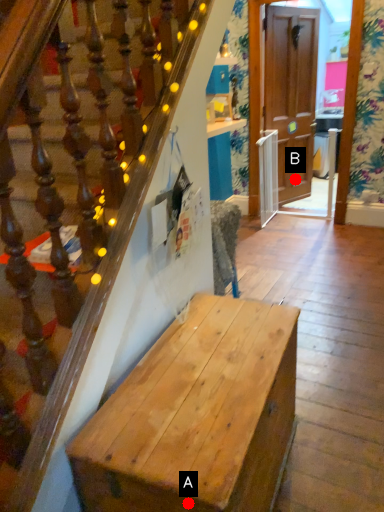
Question: Two points are circled on the image, labeled by A and B beside each circle. Among these points, which one is nearest to the camera?

Choices:
 (A) A is closer
 (B) B is closer

Answer: (A)